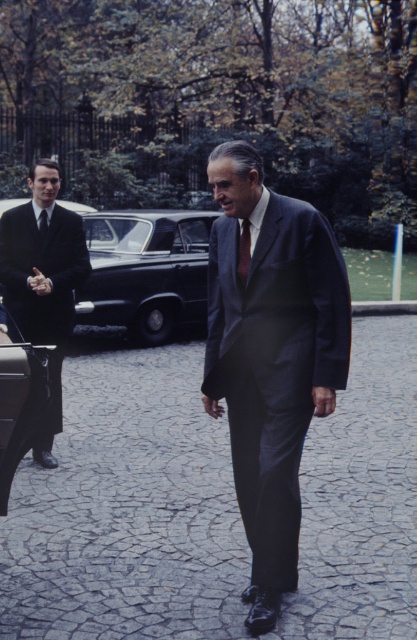
You are a photographer trying to capture a candid shot of the shiny black suit at left and the dark brown textured tie at center. Since you want to ensure both are in focus, you need to know their relative sizes. Which object is larger in the image?

The shiny black suit at left is taller than the dark brown textured tie at center, so the shiny black suit at left is larger in the image.

You are a photographer planning to take a photo of the black leather car at left and the black silk tie at left. If you want to ensure both objects are fully visible in the frame, which object should you focus on first to avoid cropping either?

You should focus on the black leather car at left first because its width is larger than the black silk tie at left, so positioning the camera to accommodate its size ensures both objects will fit without cropping.

You are a photographer standing at the camera position. You want to focus on the point that is closer to you. Which point should you choose between point (x=29, y=401) and point (x=45, y=234)?

Point (x=29, y=401) is closer to the camera than point (x=45, y=234), so you should choose point (x=29, y=401) to focus on.